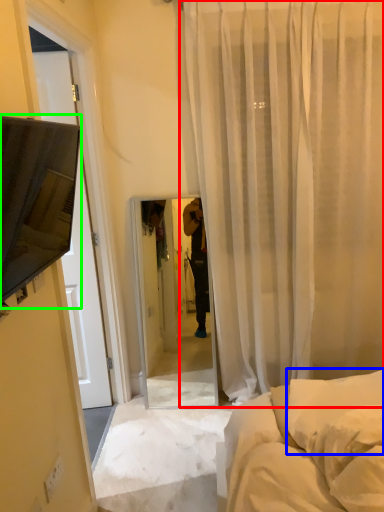
Question: Estimate the real-world distances between objects in this image. Which object is closer to curtain (highlighted by a red box), pillow (highlighted by a blue box) or canopy bed (highlighted by a green box)?

Choices:
 (A) pillow
 (B) canopy bed

Answer: (A)